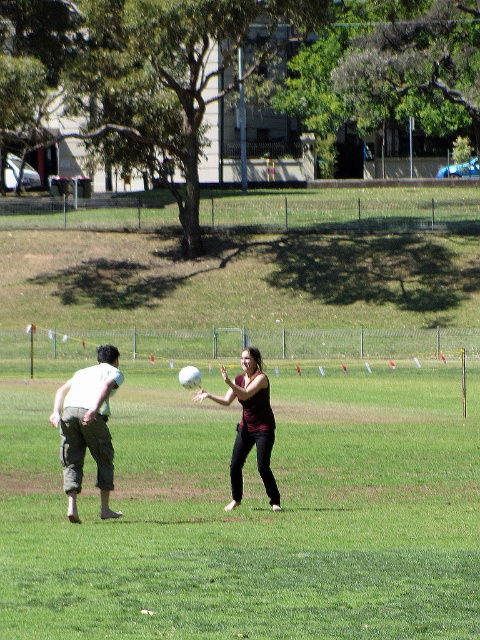
Question: Is matte white frisbee at center to the right of light green cotton shirt at left from the viewer's perspective?

Choices:
 (A) yes
 (B) no

Answer: (A)

Question: Is white matte ball at center in front of matte white frisbee at center?

Choices:
 (A) yes
 (B) no

Answer: (A)

Question: Which point is farther from the camera taking this photo?

Choices:
 (A) (265, 413)
 (B) (57, 417)
 (C) (216, 326)
 (D) (274, 508)

Answer: (C)

Question: Estimate the real-world distances between objects in this image. Which object is closer to the white matte ball at center?

Choices:
 (A) light green cotton shirt at left
 (B) matte white frisbee at center
 (C) matte black shirt at center

Answer: (B)

Question: Where is white matte ball at center located in relation to matte white frisbee at center in the image?

Choices:
 (A) right
 (B) left

Answer: (A)

Question: Which point is farther to the camera?

Choices:
 (A) (266, 458)
 (B) (108, 444)
 (C) (236, 387)

Answer: (C)